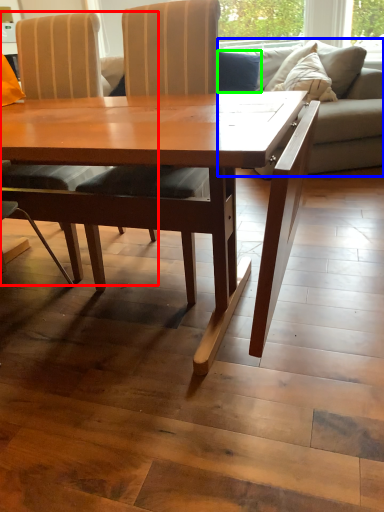
Question: Estimate the real-world distances between objects in this image. Which object is closer to chair (highlighted by a red box), studio couch (highlighted by a blue box) or pillow (highlighted by a green box)?

Choices:
 (A) studio couch
 (B) pillow

Answer: (A)